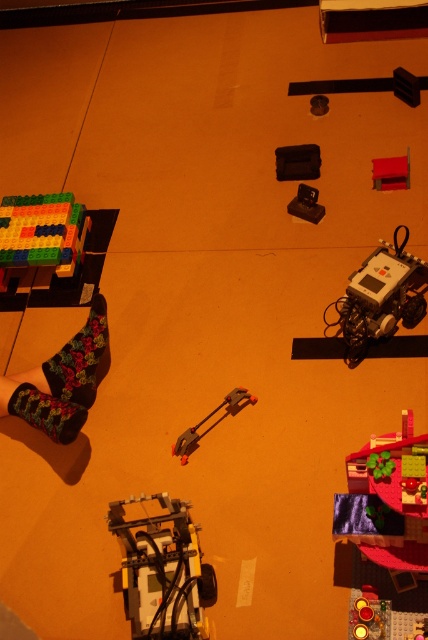
You are organizing a LEGO set and need to place the matte black case at center and the rubberized red toy at upper right into a storage box. Which object should you place first to ensure both fit properly?

The matte black case at center has a lesser height compared to the rubberized red toy at upper right, so you should place the rubberized red toy at upper right first to accommodate its taller height before placing the matte black case at center.

You are organizing your LEGO collection and need to place the matte black case at center and the rubberized red toy at upper right into a storage box. Based on their positions in the image, which object is closer to the left side of the storage box?

The matte black case at center is to the left of the rubberized red toy at upper right, so it is closer to the left side of the storage box.

You are organizing LEGO pieces on a table and notice the velvet floral socks at lower left and the metallic red clamp at center. Which object is positioned higher up on the table?

The velvet floral socks at lower left is above the metallic red clamp at center, so it is positioned higher up on the table.